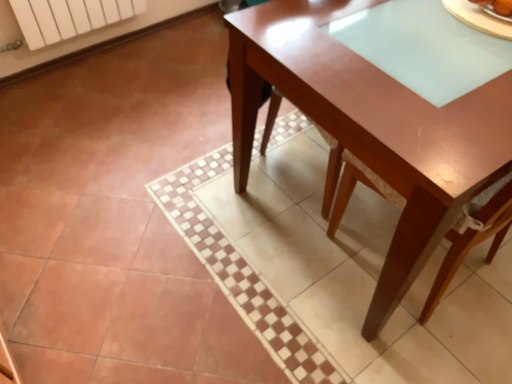
Locate an element on the screen. The image size is (512, 384). free space that is to the left of smooth brown bread at upper right is located at coordinates (442, 19).